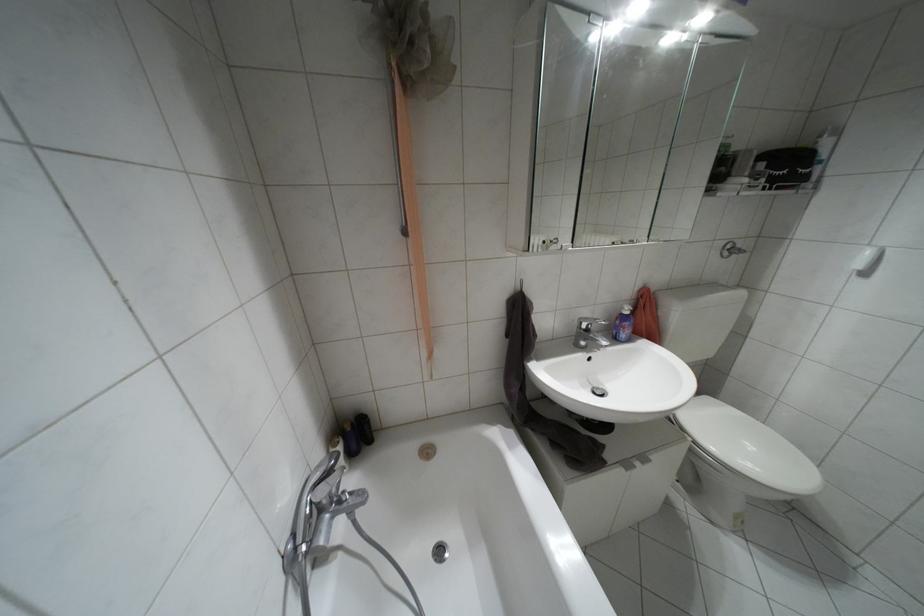
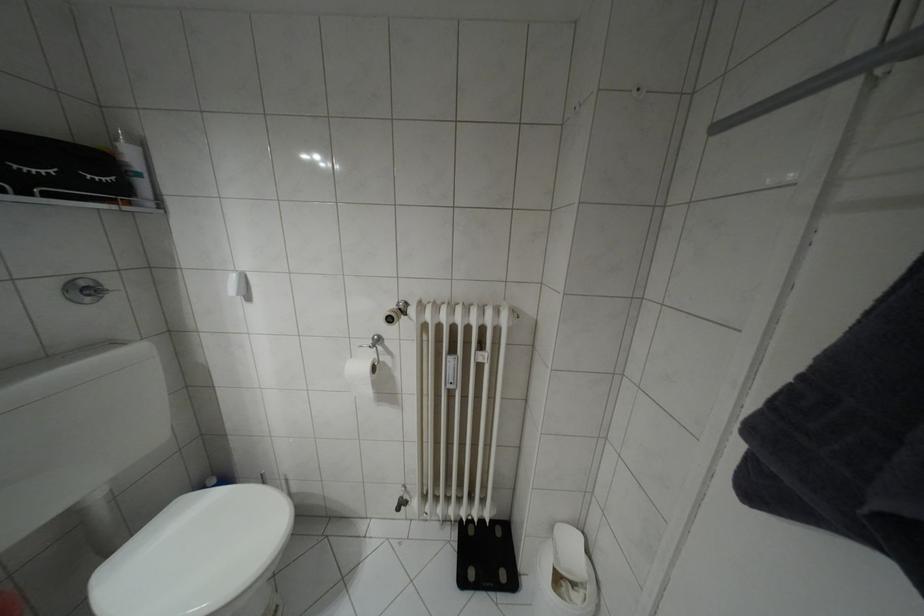
Where in the second image is the point corresponding to [777,188] from the first image?

(49, 195)